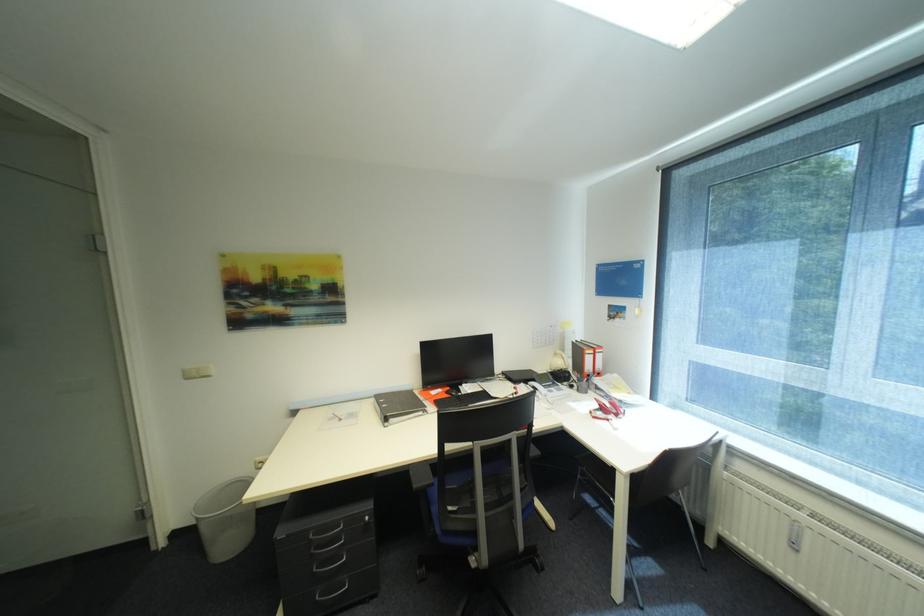
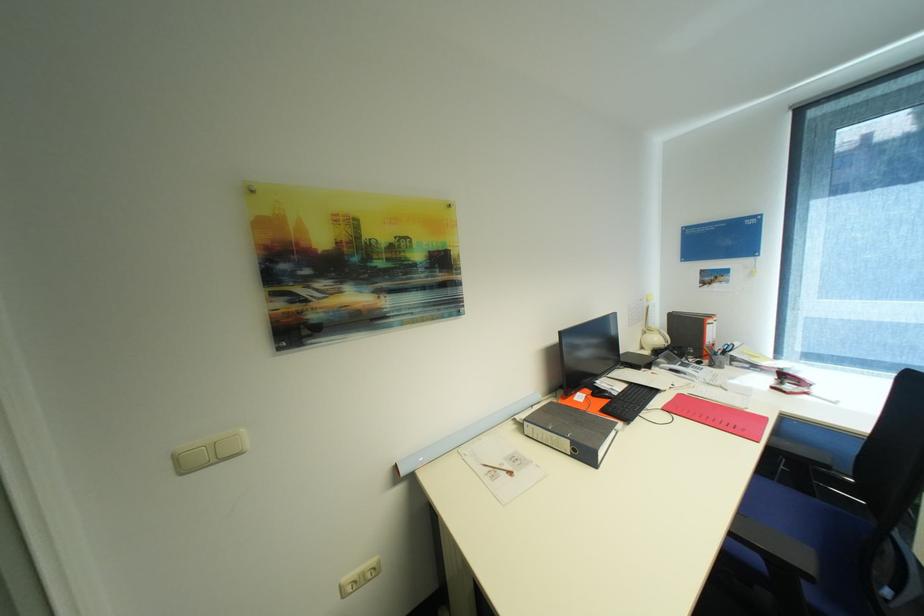
Locate, in the second image, the point that corresponds to [608,415] in the first image.

(796, 387)